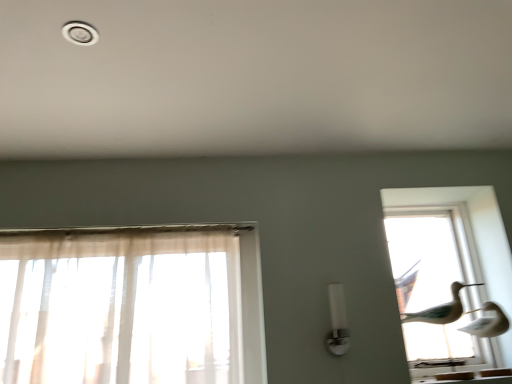
Question: Is white plastic light fixture at upper left in front of or behind transparent glass birds at right in the image?

Choices:
 (A) behind
 (B) front

Answer: (B)

Question: Is point (89, 31) closer or farther from the camera than point (473, 193)?

Choices:
 (A) farther
 (B) closer

Answer: (B)

Question: Which is nearer to the transparent glass birds at right?

Choices:
 (A) white plastic light fixture at upper left
 (B) white glossy light fixture at center

Answer: (B)

Question: Which is nearer to the transparent glass birds at right?

Choices:
 (A) white glossy light fixture at center
 (B) white plastic light fixture at upper left

Answer: (A)